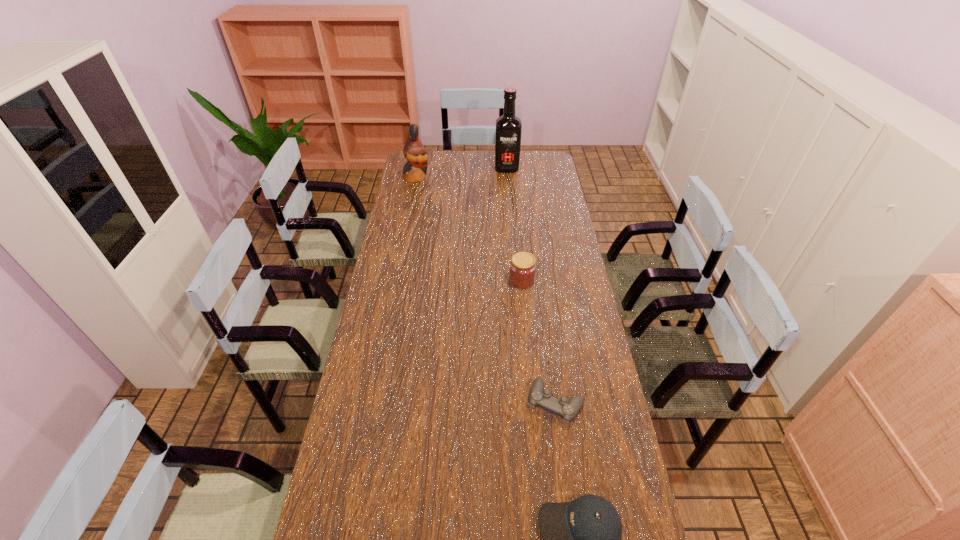
Identify the location of vacant space located on the back of the control. This screenshot has height=540, width=960. (540, 290).

Where is `liquor that is at the far edge`? This screenshot has height=540, width=960. liquor that is at the far edge is located at coordinates (508, 130).

Find the location of a particular element. parrot present at the far edge is located at coordinates (415, 153).

The width and height of the screenshot is (960, 540). I want to click on object at the left edge, so click(x=415, y=153).

Locate an element on the screen. object situated at the right edge is located at coordinates (538, 396).

This screenshot has width=960, height=540. In order to click on object present at the far left corner in this screenshot , I will do click(x=415, y=153).

This screenshot has width=960, height=540. I want to click on vacant region at the far edge of the desktop, so click(452, 169).

Where is `blank space at the left edge`? The height and width of the screenshot is (540, 960). blank space at the left edge is located at coordinates (411, 254).

The width and height of the screenshot is (960, 540). Identify the location of free space at the right edge of the desktop. (565, 218).

At what (x,y) coordinates should I click in order to perform the action: click on vacant region between the third farthest object and the liquor. Please return your answer as a coordinate pair (x, y). The image size is (960, 540). Looking at the image, I should click on (515, 225).